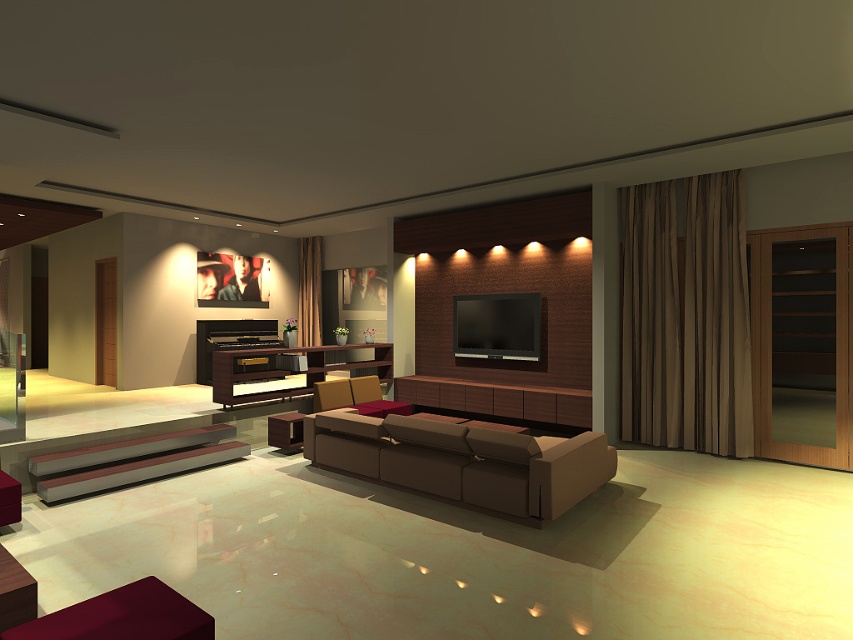
Question: Among these points, which one is nearest to the camera?

Choices:
 (A) (12, 522)
 (B) (111, 637)
 (C) (590, 433)

Answer: (B)

Question: Which of the following is the closest to the observer?

Choices:
 (A) (154, 442)
 (B) (10, 480)
 (C) (286, 420)
 (D) (10, 634)

Answer: (D)

Question: Is metallic gray bench at lower left smaller than brown leather cabinet at center?

Choices:
 (A) no
 (B) yes

Answer: (A)

Question: Which point is farther to the camera?

Choices:
 (A) (189, 608)
 (B) (413, 474)
 (C) (164, 476)

Answer: (C)

Question: Can you confirm if matte burgundy ottoman at lower left is thinner than brown leather cabinet at center?

Choices:
 (A) no
 (B) yes

Answer: (A)

Question: Does metallic gray bench at lower left appear on the right side of velvet red ottoman at lower left?

Choices:
 (A) yes
 (B) no

Answer: (A)